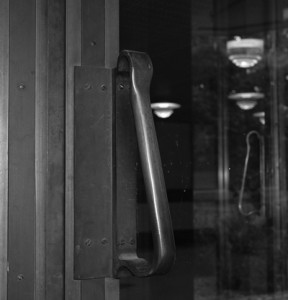
Locate an element on the screen. The height and width of the screenshot is (300, 288). screws is located at coordinates (103, 89), (103, 240), (90, 241).